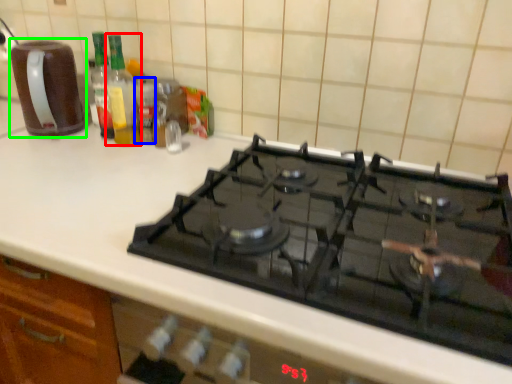
Question: Which object is the farthest from bottle (highlighted by a red box)? Choose among these: bottle (highlighted by a blue box) or kitchen appliance (highlighted by a green box).

Choices:
 (A) bottle
 (B) kitchen appliance

Answer: (B)